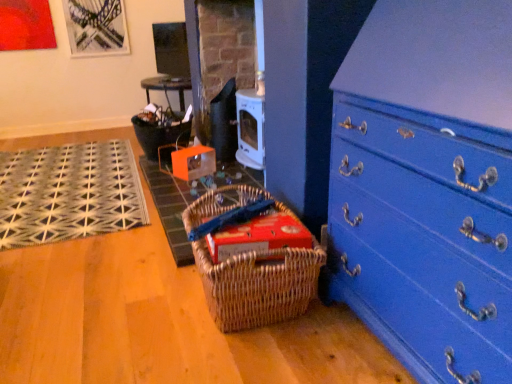
At what (x,y) coordinates should I click in order to perform the action: click on vacant space underneath black woven mat at left, acting as the second doormat starting from the right (from a real-world perspective). Please return your answer as a coordinate pair (x, y). Image resolution: width=512 pixels, height=384 pixels. Looking at the image, I should click on (66, 184).